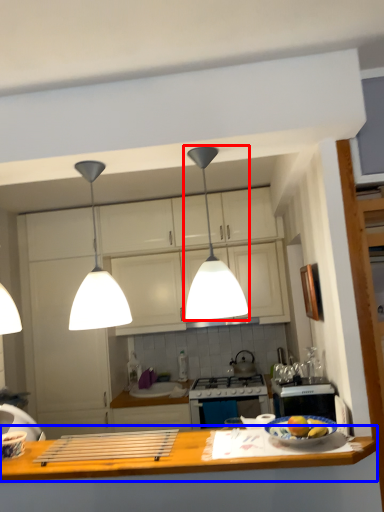
Question: Which object appears farthest to the camera in this image, light (highlighted by a red box) or countertop (highlighted by a blue box)?

Choices:
 (A) light
 (B) countertop

Answer: (A)